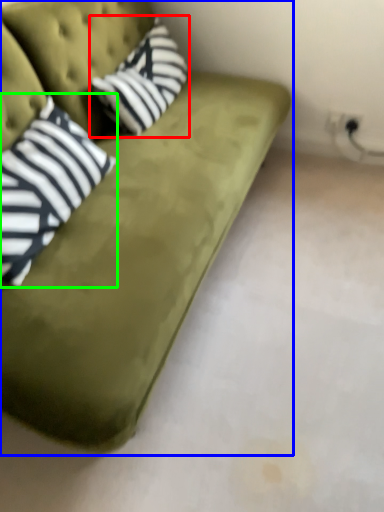
Question: Which is nearer to the throw pillow (highlighted by a red box)? studio couch (highlighted by a blue box) or pillow (highlighted by a green box).

Choices:
 (A) studio couch
 (B) pillow

Answer: (A)